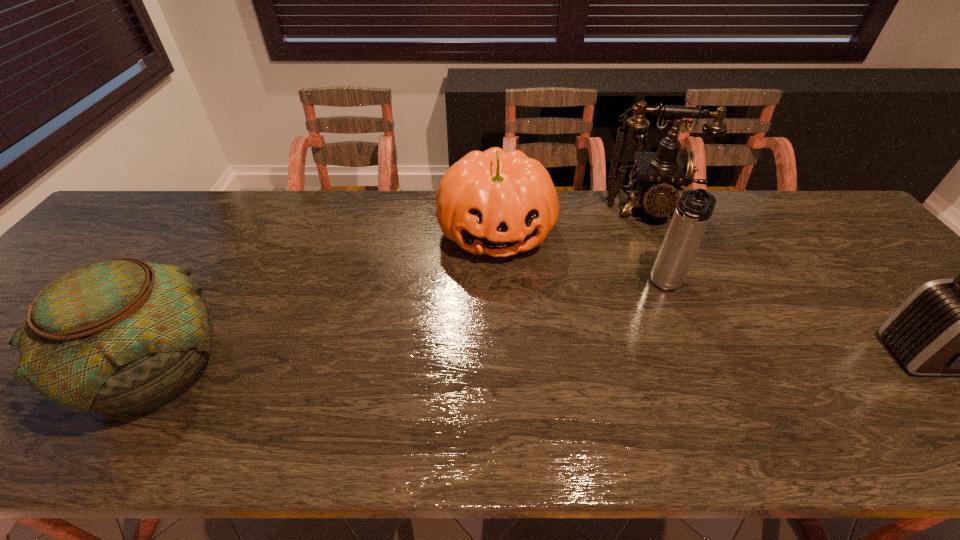
Find the location of a particular element. free space on the desktop that is between the pottery and the rightmost object and is positioned on the carved face of the pumpkin is located at coordinates (519, 363).

At what (x,y) coordinates should I click in order to perform the action: click on free spot on the desktop that is between the pottery and the rightmost object and is positioned on the handle side of the thermos bottle. Please return your answer as a coordinate pair (x, y). Image resolution: width=960 pixels, height=540 pixels. Looking at the image, I should click on (633, 361).

Locate an element on the screen. vacant space on the desktop that is between the pottery and the rightmost object and is positioned on the rotary dial of the tallest object is located at coordinates (675, 360).